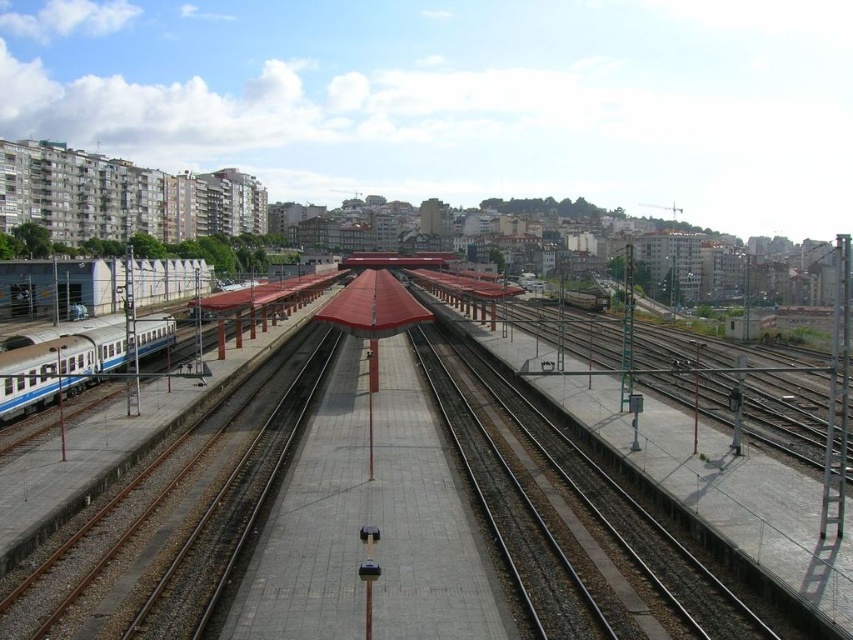
You are standing on the platform at the railway station and want to walk to the train tracks to take a photo. According to the image, where exactly are the metallic train tracks at center located?

The metallic train tracks at center are located at point coordinates of 0.820 on the x axis and 0.615 on the y axis.

You are a maintenance worker needing to walk from the silver metallic passenger train at left to the smooth concrete train track at center. Which direction should you walk to reach the track?

The smooth concrete train track at center is bigger than the silver metallic passenger train at left, so you should walk towards the center to reach the track.

You are a railway worker checking the layout of the station. You need to know if the metallic train tracks at center can fully accommodate the silver metallic passenger train at left in terms of length. Based on the scene, what is your conclusion?

The metallic train tracks at center is shorter than the silver metallic passenger train at left, so the tracks cannot fully accommodate the train in terms of length.